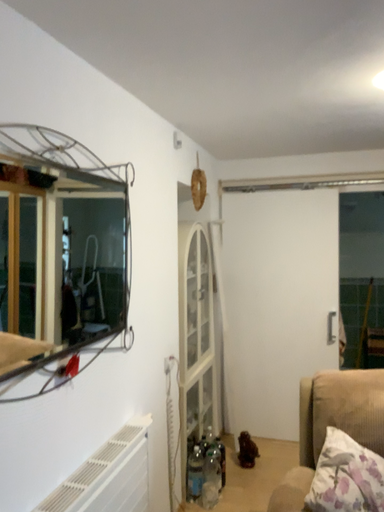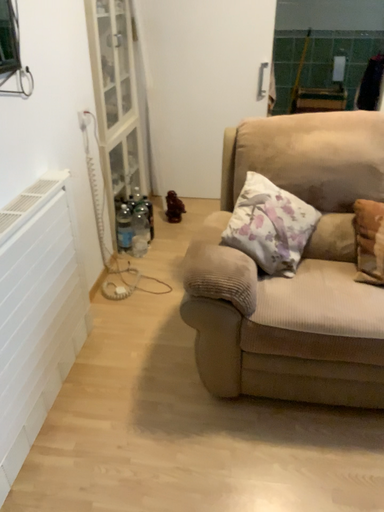
Question: Which way did the camera rotate in the video?

Choices:
 (A) rotated downward
 (B) rotated upward

Answer: (A)